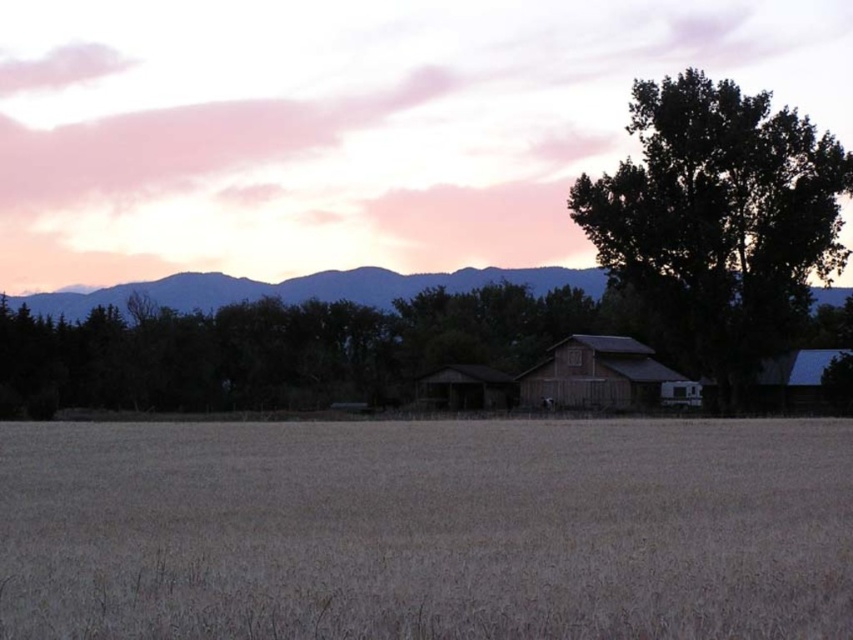
Does brown grassy field at lower center appear on the left side of dark green leafy tree at center?

Indeed, brown grassy field at lower center is positioned on the left side of dark green leafy tree at center.

Is brown grassy field at lower center to the right of dark green leafy tree at center from the viewer's perspective?

Incorrect, brown grassy field at lower center is not on the right side of dark green leafy tree at center.

What do you see at coordinates (427, 531) in the screenshot? I see `brown grassy field at lower center` at bounding box center [427, 531].

Locate an element on the screen. This screenshot has width=853, height=640. brown grassy field at lower center is located at coordinates coord(427,531).

Is point (784, 524) less distant than point (602, 358)?

Yes.

Measure the distance between point (x=537, y=467) and camera.

Point (x=537, y=467) is 29.84 meters away from camera.

Locate an element on the screen. Image resolution: width=853 pixels, height=640 pixels. brown grassy field at lower center is located at coordinates (427, 531).

Does dark green leafy tree at center appear on the left side of wooden barn at center?

In fact, dark green leafy tree at center is to the right of wooden barn at center.

How much distance is there between dark green leafy tree at center and wooden barn at center?

dark green leafy tree at center and wooden barn at center are 46.64 feet apart.

Is point (720, 316) behind point (581, 365)?

No, (720, 316) is in front of (581, 365).

Where is `dark green leafy tree at center`? This screenshot has width=853, height=640. dark green leafy tree at center is located at coordinates (718, 221).